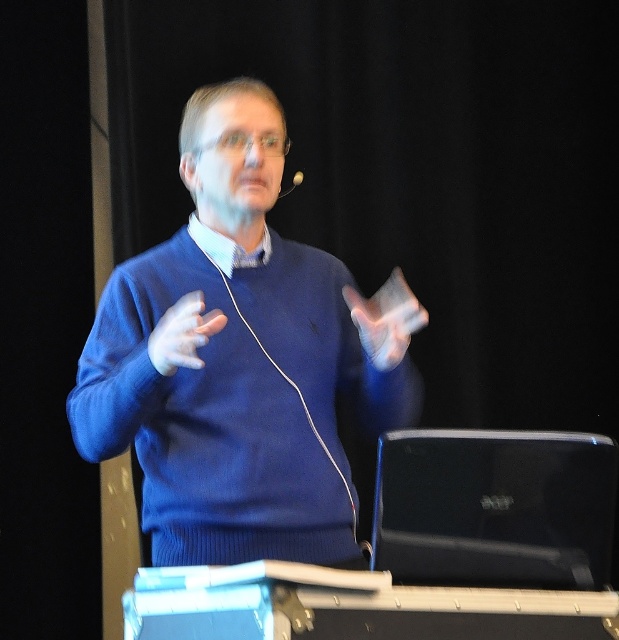
You are an event organizer checking the setup for a presentation. You notice the blue knitwear at center and the silver metallic earphone at upper center. Which object is positioned closer to the front of the stage?

The blue knitwear at center is closer to the viewer than the silver metallic earphone at upper center, so the blue knitwear at center is positioned closer to the front of the stage.

You are designing a costume for a play and need to choose between the blue knitwear at center and the matte blue sweater at center. The costume requires the garment with the wider width. Which one should you select?

The blue knitwear at center has a larger width than the matte blue sweater at center, so you should select the blue knitwear at center for the costume.